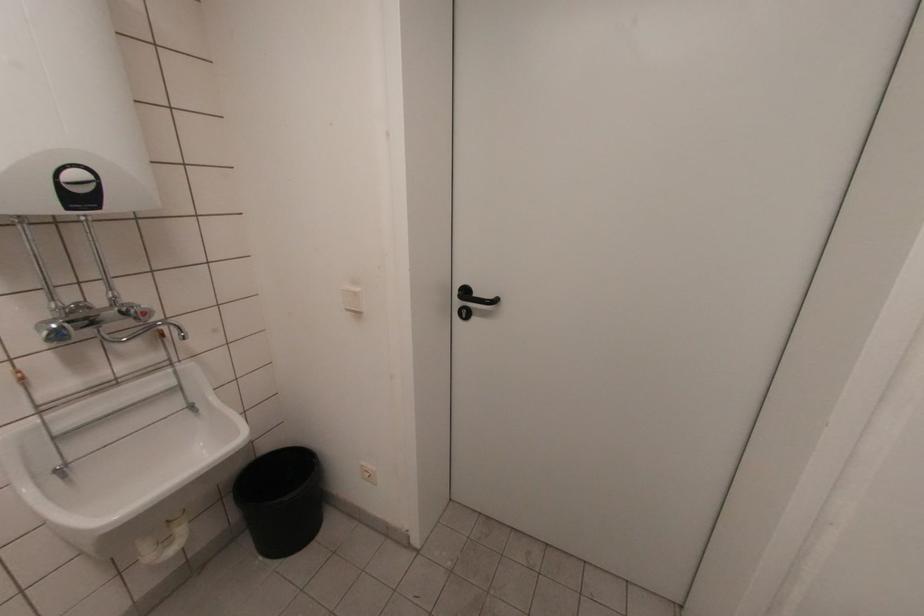
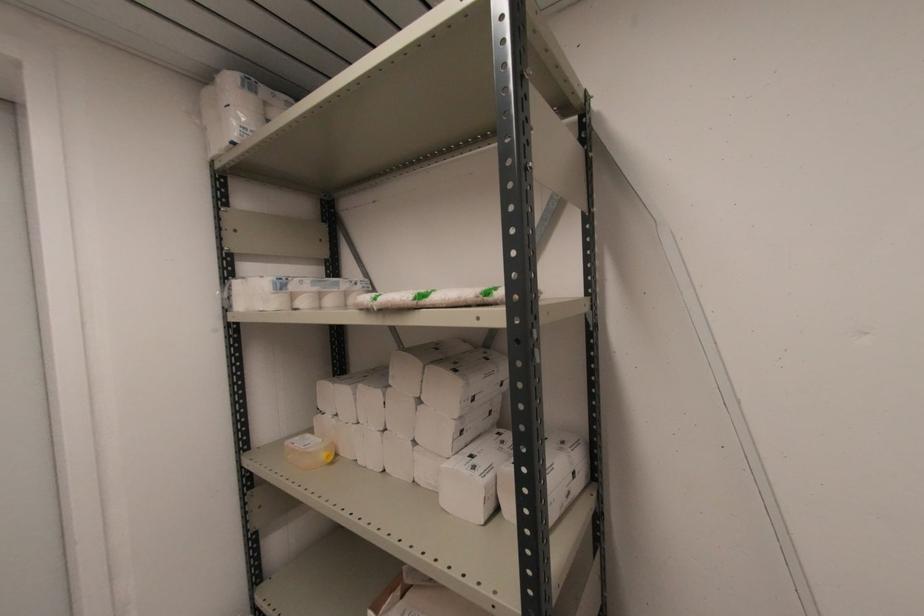
Question: Based on the continuous images, in which direction is the camera rotating? Reply with the corresponding letter.

Choices:
 (A) Left
 (B) Right
 (C) Up
 (D) Down

Answer: (B)